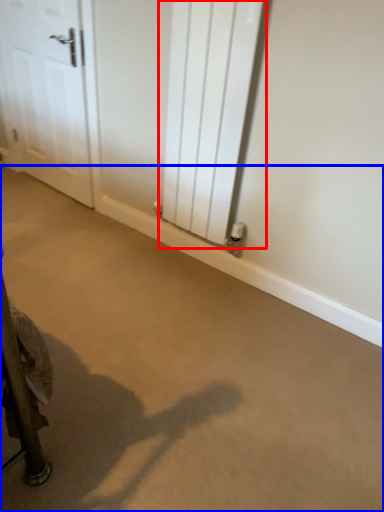
Question: Which object is closer to the camera taking this photo, radiator (highlighted by a red box) or concrete (highlighted by a blue box)?

Choices:
 (A) radiator
 (B) concrete

Answer: (B)